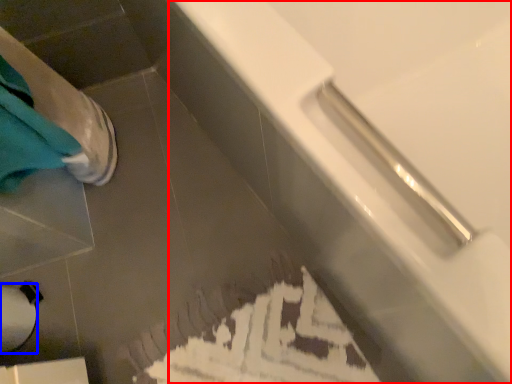
Question: Which point is further to the camera, bathtub (highlighted by a red box) or toilet paper (highlighted by a blue box)?

Choices:
 (A) bathtub
 (B) toilet paper

Answer: (B)